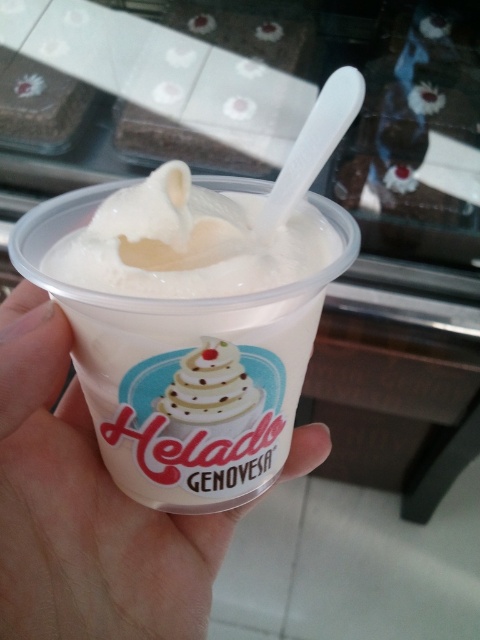
Question: Is transparent plastic cup at center to the left of white matte plastic cup at center from the viewer's perspective?

Choices:
 (A) yes
 (B) no

Answer: (A)

Question: Does transparent plastic cup at center have a smaller size compared to white matte plastic cup at center?

Choices:
 (A) no
 (B) yes

Answer: (A)

Question: Does transparent plastic cup at center come behind white matte plastic cup at center?

Choices:
 (A) yes
 (B) no

Answer: (A)

Question: Which point appears farthest from the camera in this image?

Choices:
 (A) (197, 444)
 (B) (73, 474)

Answer: (B)